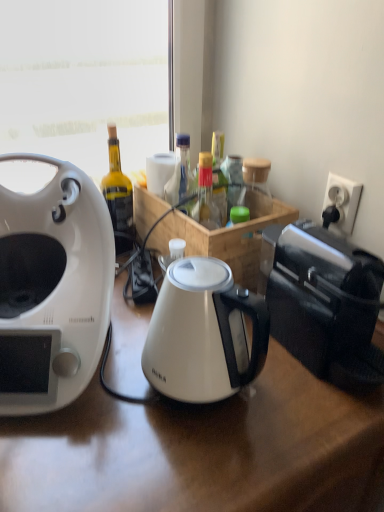
Question: Is white glossy coffee maker at left positioned with its back to white plastic power outlet at upper right?

Choices:
 (A) no
 (B) yes

Answer: (A)

Question: Is white glossy coffee maker at left aimed at white plastic power outlet at upper right?

Choices:
 (A) yes
 (B) no

Answer: (B)

Question: Does white glossy coffee maker at left have a lesser height compared to white plastic power outlet at upper right?

Choices:
 (A) no
 (B) yes

Answer: (A)

Question: From the image's perspective, is white glossy coffee maker at left located beneath white plastic power outlet at upper right?

Choices:
 (A) yes
 (B) no

Answer: (A)

Question: Does white glossy coffee maker at left have a larger size compared to white plastic power outlet at upper right?

Choices:
 (A) yes
 (B) no

Answer: (A)

Question: Does white glossy coffee maker at left touch white plastic power outlet at upper right?

Choices:
 (A) no
 (B) yes

Answer: (A)

Question: Can you confirm if translucent glass bottle at center is thinner than white plastic power outlet at upper right?

Choices:
 (A) no
 (B) yes

Answer: (A)

Question: Could you tell me if translucent glass bottle at center is facing white plastic power outlet at upper right?

Choices:
 (A) no
 (B) yes

Answer: (A)

Question: Can you confirm if translucent glass bottle at center is taller than white plastic power outlet at upper right?

Choices:
 (A) yes
 (B) no

Answer: (A)

Question: Does translucent glass bottle at center lie behind white plastic power outlet at upper right?

Choices:
 (A) no
 (B) yes

Answer: (B)

Question: Is translucent glass bottle at center positioned far away from white plastic power outlet at upper right?

Choices:
 (A) yes
 (B) no

Answer: (B)

Question: From the image's perspective, is translucent glass bottle at center under white plastic power outlet at upper right?

Choices:
 (A) yes
 (B) no

Answer: (B)

Question: From the image's perspective, is white glossy electric kettle at center located beneath white glossy coffee maker at left?

Choices:
 (A) yes
 (B) no

Answer: (A)